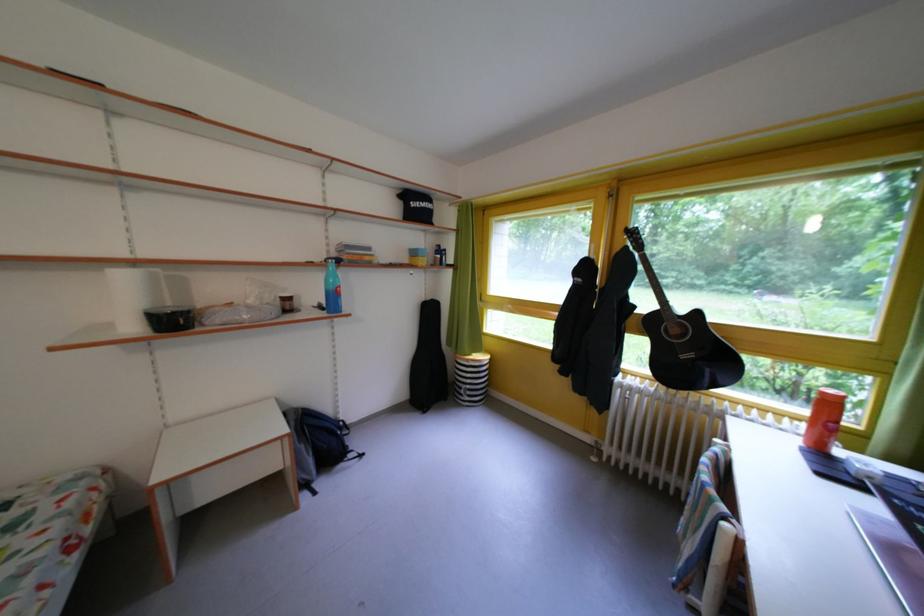
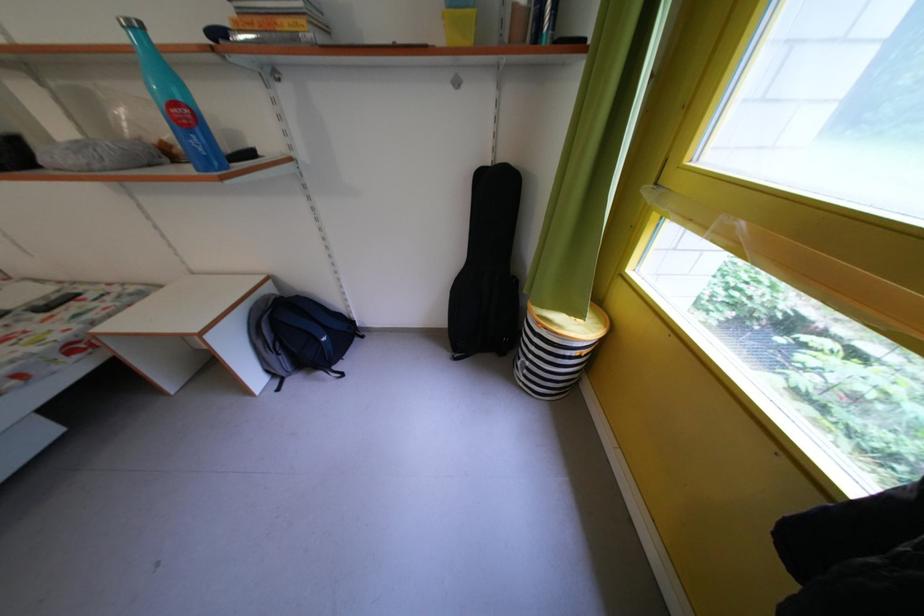
Locate, in the second image, the point that corresponds to point (478, 392) in the first image.

(537, 369)